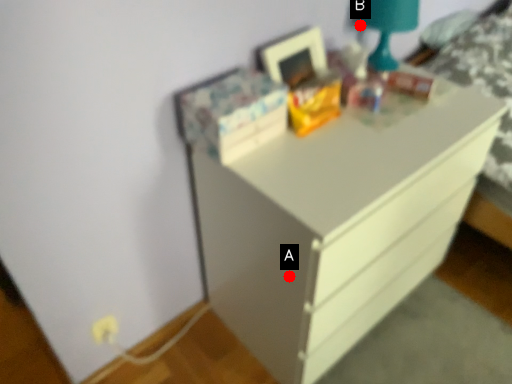
Question: Two points are circled on the image, labeled by A and B beside each circle. Which point is closer to the camera?

Choices:
 (A) A is closer
 (B) B is closer

Answer: (A)